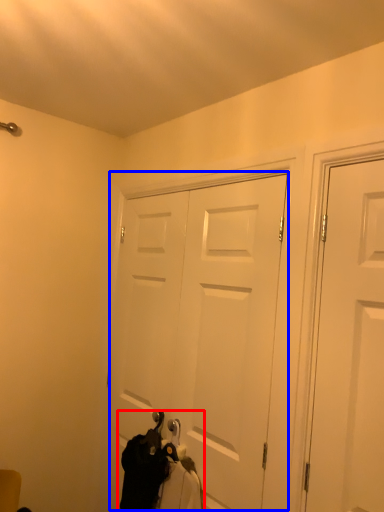
Question: Which of the following is the closest to the observer, laundry (highlighted by a red box) or door (highlighted by a blue box)?

Choices:
 (A) laundry
 (B) door

Answer: (A)